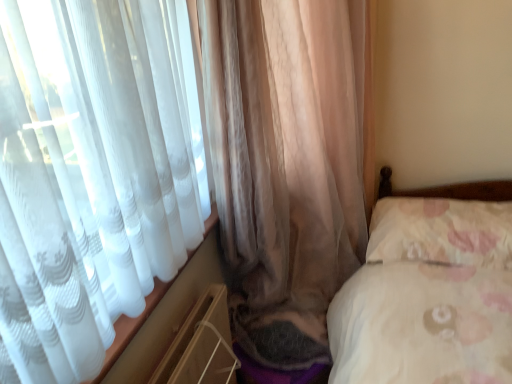
What do you see at coordinates (91, 175) in the screenshot?
I see `translucent fabric curtain at left, which is counted as the 2th curtain, starting from the left` at bounding box center [91, 175].

Describe the element at coordinates (441, 231) in the screenshot. I see `fluffy white pillow at right` at that location.

Locate an element on the screen. The width and height of the screenshot is (512, 384). translucent fabric curtain at left, which is counted as the 2th curtain, starting from the left is located at coordinates (91, 175).

Is translucent beige curtain at left, the 1th curtain in the left-to-right sequence, to the right of fluffy white pillow at right from the viewer's perspective?

In fact, translucent beige curtain at left, the 1th curtain in the left-to-right sequence, is to the left of fluffy white pillow at right.

Is translucent beige curtain at left, positioned as the 2th curtain in right-to-left order, far away from fluffy white pillow at right?

No, translucent beige curtain at left, positioned as the 2th curtain in right-to-left order, is not far from fluffy white pillow at right.

Between point (284, 92) and point (393, 232), which one is positioned in front?

The point (284, 92) is more forward.

Considering the sizes of fluffy white pillow at right and translucent beige curtain at left, the 1th curtain in the left-to-right sequence, in the image, is fluffy white pillow at right taller or shorter than translucent beige curtain at left, the 1th curtain in the left-to-right sequence,?

Considering their sizes, fluffy white pillow at right has less height than translucent beige curtain at left, the 1th curtain in the left-to-right sequence.

From a real-world perspective, is fluffy white pillow at right under translucent beige curtain at left, the 1th curtain in the left-to-right sequence?

Yes, from a real-world perspective, fluffy white pillow at right is under translucent beige curtain at left, the 1th curtain in the left-to-right sequence.

Is fluffy white pillow at right not inside translucent beige curtain at left, the 1th curtain in the left-to-right sequence?

No, fluffy white pillow at right is inside translucent beige curtain at left, the 1th curtain in the left-to-right sequence,'s boundary.

Consider the image. Could you measure the distance between translucent fabric curtain at left, marked as the 1th curtain in a right-to-left arrangement, and translucent beige curtain at left, the 1th curtain in the left-to-right sequence?

A distance of 4.66 inches exists between translucent fabric curtain at left, marked as the 1th curtain in a right-to-left arrangement, and translucent beige curtain at left, the 1th curtain in the left-to-right sequence.

Which is more to the right, translucent fabric curtain at left, marked as the 1th curtain in a right-to-left arrangement, or translucent beige curtain at left, the 1th curtain in the left-to-right sequence?

translucent fabric curtain at left, marked as the 1th curtain in a right-to-left arrangement.

Who is taller, translucent fabric curtain at left, marked as the 1th curtain in a right-to-left arrangement, or translucent beige curtain at left, positioned as the 2th curtain in right-to-left order?

Standing taller between the two is translucent beige curtain at left, positioned as the 2th curtain in right-to-left order.

Can you tell me how much translucent fabric curtain at left, which is counted as the 2th curtain, starting from the left, and translucent beige curtain at left, the 1th curtain in the left-to-right sequence, differ in facing direction?

translucent fabric curtain at left, which is counted as the 2th curtain, starting from the left, and translucent beige curtain at left, the 1th curtain in the left-to-right sequence, are facing 46.8 degrees away from each other.

Looking at this image, between translucent beige curtain at left, positioned as the 2th curtain in right-to-left order, and translucent fabric curtain at left, which is counted as the 2th curtain, starting from the left, which one has smaller width?

translucent fabric curtain at left, which is counted as the 2th curtain, starting from the left, is thinner.

Is translucent beige curtain at left, the 1th curtain in the left-to-right sequence, touching translucent fabric curtain at left, which is counted as the 2th curtain, starting from the left?

translucent beige curtain at left, the 1th curtain in the left-to-right sequence, and translucent fabric curtain at left, which is counted as the 2th curtain, starting from the left, are clearly separated.

From the image's perspective, is translucent beige curtain at left, positioned as the 2th curtain in right-to-left order, located above or below translucent fabric curtain at left, which is counted as the 2th curtain, starting from the left?

Based on their image positions, translucent beige curtain at left, positioned as the 2th curtain in right-to-left order, is located above translucent fabric curtain at left, which is counted as the 2th curtain, starting from the left.

Find the location of a particular element. curtain lying on the left of translucent fabric curtain at left, which is counted as the 2th curtain, starting from the left is located at coordinates (286, 164).

The width and height of the screenshot is (512, 384). In the image, there is a translucent fabric curtain at left, which is counted as the 2th curtain, starting from the left. What are the coordinates of `pillow below it (from a real-world perspective)` in the screenshot? It's located at (441, 231).

Which of these two, translucent fabric curtain at left, marked as the 1th curtain in a right-to-left arrangement, or fluffy white pillow at right, is thinner?

translucent fabric curtain at left, marked as the 1th curtain in a right-to-left arrangement.

Is fluffy white pillow at right at the back of translucent fabric curtain at left, marked as the 1th curtain in a right-to-left arrangement?

Correct, translucent fabric curtain at left, marked as the 1th curtain in a right-to-left arrangement, is looking away from fluffy white pillow at right.

Is fluffy white pillow at right positioned with its back to translucent fabric curtain at left, marked as the 1th curtain in a right-to-left arrangement?

fluffy white pillow at right does not have its back to translucent fabric curtain at left, marked as the 1th curtain in a right-to-left arrangement.

Would you say fluffy white pillow at right is inside or outside translucent fabric curtain at left, marked as the 1th curtain in a right-to-left arrangement?

fluffy white pillow at right is located beyond the bounds of translucent fabric curtain at left, marked as the 1th curtain in a right-to-left arrangement.

This screenshot has width=512, height=384. What are the coordinates of `pillow located above the translucent fabric curtain at left, which is counted as the 2th curtain, starting from the left (from the image's perspective)` in the screenshot? It's located at (441, 231).

Which of these two, fluffy white pillow at right or translucent fabric curtain at left, marked as the 1th curtain in a right-to-left arrangement, stands shorter?

fluffy white pillow at right.

From a real-world perspective, starting from the fluffy white pillow at right, which curtain is the 2nd one vertically above it? Please provide its 2D coordinates.

[(286, 164)]

This screenshot has height=384, width=512. I want to click on curtain above the fluffy white pillow at right (from the image's perspective), so click(286, 164).

Considering their positions, is translucent fabric curtain at left, marked as the 1th curtain in a right-to-left arrangement, positioned closer to fluffy white pillow at right than translucent beige curtain at left, the 1th curtain in the left-to-right sequence?

translucent beige curtain at left, the 1th curtain in the left-to-right sequence.

Which object lies nearer to the anchor point translucent beige curtain at left, the 1th curtain in the left-to-right sequence, fluffy white pillow at right or translucent fabric curtain at left, which is counted as the 2th curtain, starting from the left?

Based on the image, translucent fabric curtain at left, which is counted as the 2th curtain, starting from the left, appears to be nearer to translucent beige curtain at left, the 1th curtain in the left-to-right sequence.

Consider the image. From the image, which object appears to be nearer to fluffy white pillow at right, translucent beige curtain at left, positioned as the 2th curtain in right-to-left order, or translucent fabric curtain at left, marked as the 1th curtain in a right-to-left arrangement?

translucent beige curtain at left, positioned as the 2th curtain in right-to-left order, is positioned closer to the anchor fluffy white pillow at right.

Based on the photo, estimate the real-world distances between objects in this image. Which object is closer to translucent fabric curtain at left, which is counted as the 2th curtain, starting from the left, fluffy white pillow at right or translucent beige curtain at left, positioned as the 2th curtain in right-to-left order?

translucent beige curtain at left, positioned as the 2th curtain in right-to-left order, is closer to translucent fabric curtain at left, which is counted as the 2th curtain, starting from the left.

Estimate the real-world distances between objects in this image. Which object is further from translucent beige curtain at left, the 1th curtain in the left-to-right sequence, translucent fabric curtain at left, marked as the 1th curtain in a right-to-left arrangement, or fluffy white pillow at right?

fluffy white pillow at right lies further to translucent beige curtain at left, the 1th curtain in the left-to-right sequence, than the other object.

Based on their spatial positions, is translucent beige curtain at left, positioned as the 2th curtain in right-to-left order, or fluffy white pillow at right closer to translucent fabric curtain at left, marked as the 1th curtain in a right-to-left arrangement?

translucent beige curtain at left, positioned as the 2th curtain in right-to-left order, is positioned closer to the anchor translucent fabric curtain at left, marked as the 1th curtain in a right-to-left arrangement.

Where is `curtain between translucent fabric curtain at left, marked as the 1th curtain in a right-to-left arrangement, and fluffy white pillow at right in the front-back direction`? The image size is (512, 384). curtain between translucent fabric curtain at left, marked as the 1th curtain in a right-to-left arrangement, and fluffy white pillow at right in the front-back direction is located at coordinates (286, 164).